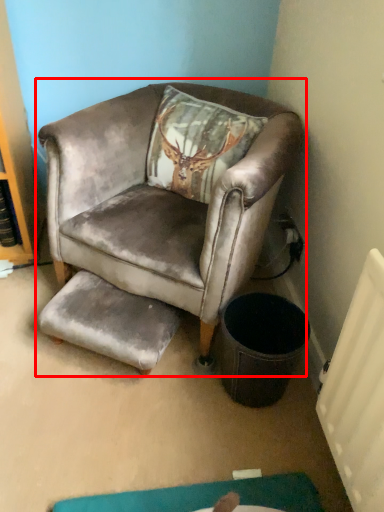
Question: From the image's perspective, where is chair (annotated by the red box) located in relation to footrest in the image?

Choices:
 (A) above
 (B) below

Answer: (A)